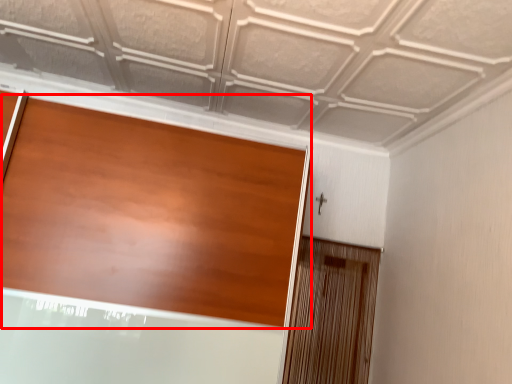
Question: From the image, what is the correct spatial relationship of door (annotated by the red box) in relation to screen door?

Choices:
 (A) right
 (B) left

Answer: (B)